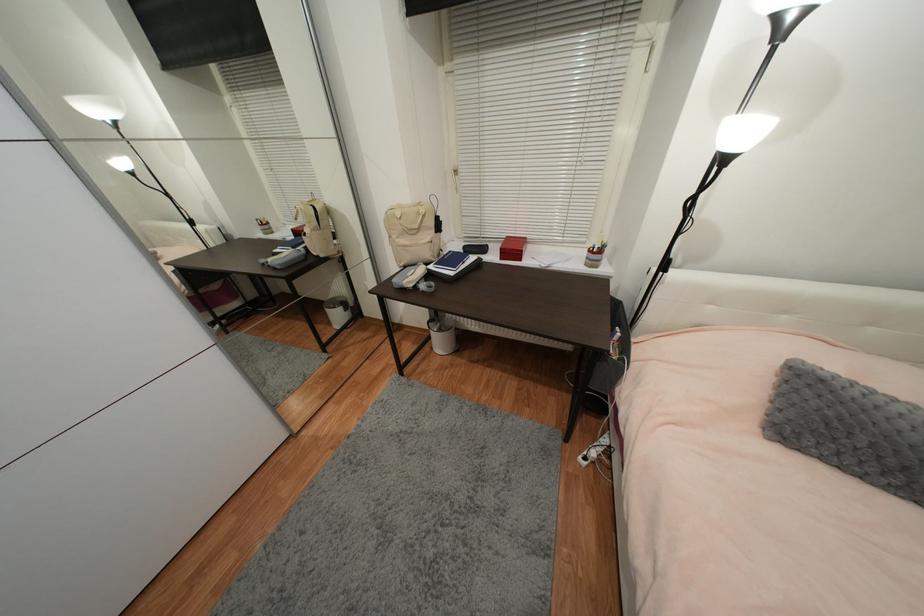
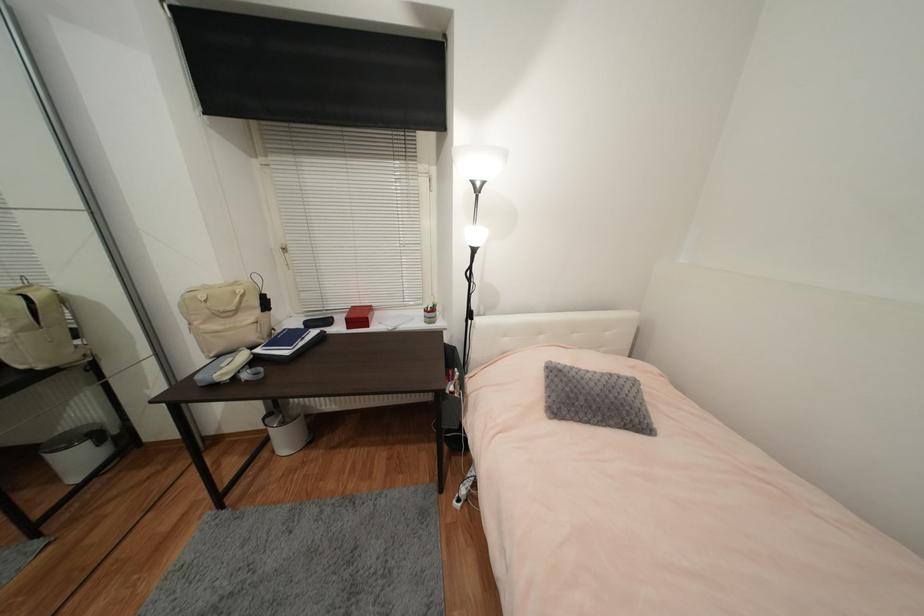
In the second image, find the point that corresponds to (593,253) in the first image.

(430, 312)